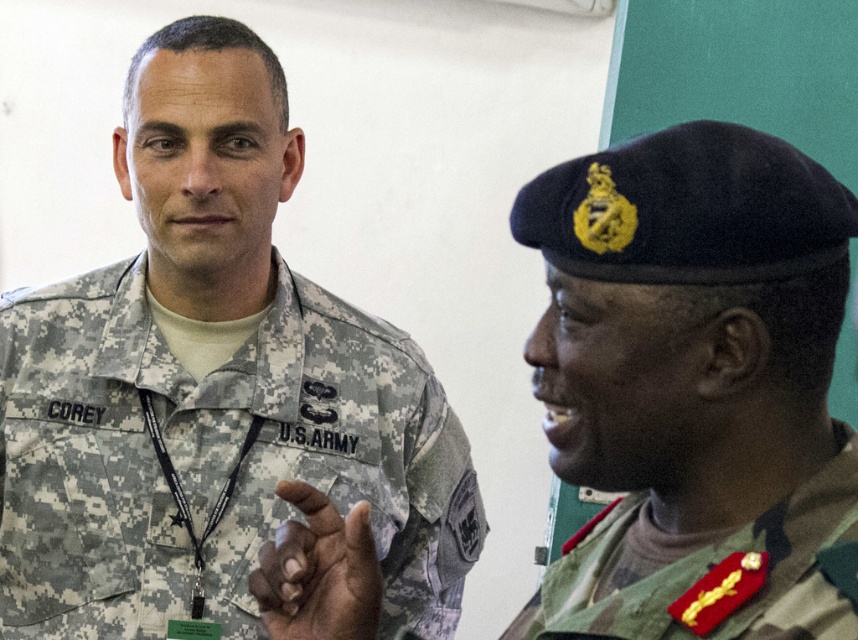
Is camouflage fabric us army uniform at left shorter than green camouflage uniform at right?

In fact, camouflage fabric us army uniform at left may be taller than green camouflage uniform at right.

Can you confirm if camouflage fabric us army uniform at left is taller than green camouflage uniform at right?

Indeed, camouflage fabric us army uniform at left has a greater height compared to green camouflage uniform at right.

The image size is (858, 640). Find the location of `camouflage fabric us army uniform at left`. camouflage fabric us army uniform at left is located at coordinates 213,460.